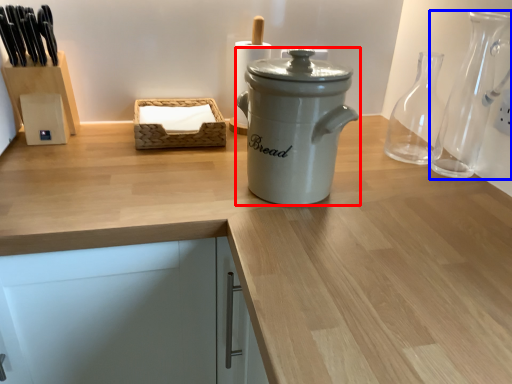
Question: Which point is further to the camera, kitchen appliance (highlighted by a red box) or glass vase (highlighted by a blue box)?

Choices:
 (A) kitchen appliance
 (B) glass vase

Answer: (B)